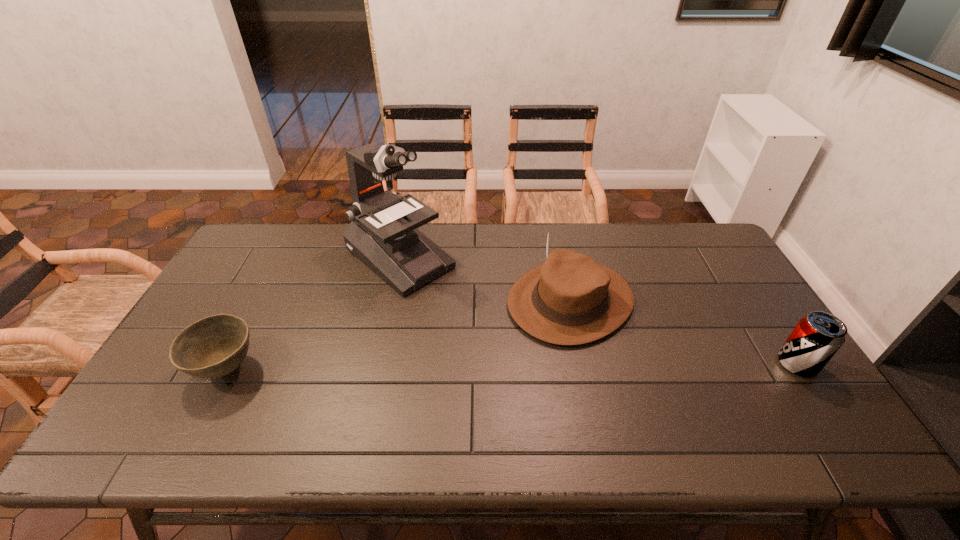
Locate an element on the screen. the shortest object is located at coordinates (214, 346).

The width and height of the screenshot is (960, 540). Identify the location of the leftmost object. (214, 346).

Identify the location of the rightmost object. Image resolution: width=960 pixels, height=540 pixels. (816, 338).

Identify the location of the second shortest object. This screenshot has width=960, height=540. (816, 338).

This screenshot has width=960, height=540. What are the coordinates of `fedora` in the screenshot? It's located at (571, 299).

Find the location of `the third object from left to right`. the third object from left to right is located at coordinates (571, 299).

The width and height of the screenshot is (960, 540). Find the location of `microscope`. microscope is located at coordinates (383, 234).

Image resolution: width=960 pixels, height=540 pixels. I want to click on the tallest object, so click(383, 234).

Identify the location of free space located 0.110m on the back of the leftmost object. Image resolution: width=960 pixels, height=540 pixels. (255, 313).

In order to click on free space located 0.250m on the left of the rightmost object in this screenshot , I will do `click(684, 364)`.